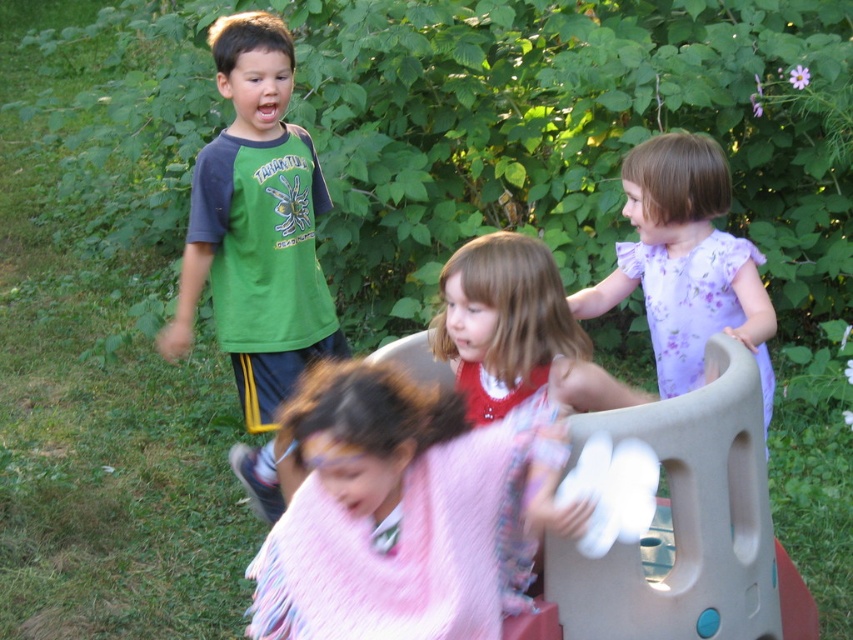
Can you confirm if fuzzy pink blanket at center is thinner than purple floral dress at upper right?

Yes.

In the scene shown: Which is above, fuzzy pink blanket at center or purple floral dress at upper right?

Positioned higher is purple floral dress at upper right.

Describe the element at coordinates (405, 512) in the screenshot. I see `fuzzy pink blanket at center` at that location.

Locate an element on the screen. fuzzy pink blanket at center is located at coordinates (405, 512).

How distant is fuzzy pink blanket at center from green raglan shirt at upper left?

fuzzy pink blanket at center and green raglan shirt at upper left are 1.77 meters apart from each other.

Is point (514, 448) farther from viewer compared to point (323, 195)?

No, it is not.

Locate an element on the screen. fuzzy pink blanket at center is located at coordinates (405, 512).

Which is in front, point (276, 96) or point (724, 275)?

Point (724, 275) is in front.

Who is positioned more to the left, green raglan shirt at upper left or purple floral dress at upper right?

green raglan shirt at upper left is more to the left.

This screenshot has width=853, height=640. I want to click on green raglan shirt at upper left, so click(x=256, y=225).